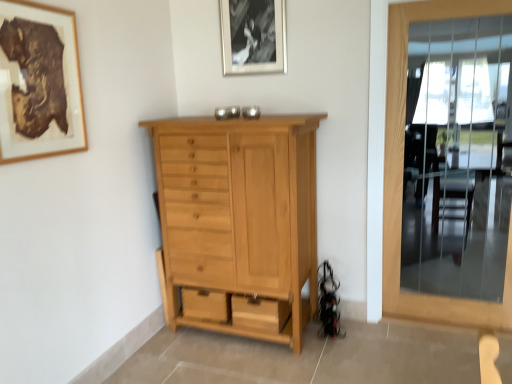
What do you see at coordinates (253, 36) in the screenshot? The width and height of the screenshot is (512, 384). I see `black matte picture frame at upper center, which is the second picture frame in bottom-to-top order` at bounding box center [253, 36].

Locate an element on the screen. The image size is (512, 384). clear glass door at right is located at coordinates (402, 176).

Between clear glass door at right and black matte picture frame at upper center, which is the second picture frame in bottom-to-top order, which one has smaller size?

Smaller between the two is black matte picture frame at upper center, which is the second picture frame in bottom-to-top order.

Who is more distant, clear glass door at right or black matte picture frame at upper center, which is counted as the first picture frame, starting from the top?

black matte picture frame at upper center, which is counted as the first picture frame, starting from the top, is further from the camera.

Which is correct: clear glass door at right is inside black matte picture frame at upper center, which is the second picture frame in bottom-to-top order, or outside of it?

clear glass door at right is outside black matte picture frame at upper center, which is the second picture frame in bottom-to-top order.

Is black matte picture frame at upper center, which is counted as the first picture frame, starting from the top, in front of or behind clear glass door at right in the image?

black matte picture frame at upper center, which is counted as the first picture frame, starting from the top, is behind clear glass door at right.

Can you tell me how much black matte picture frame at upper center, which is counted as the 2th picture frame, starting from the left, and clear glass door at right differ in facing direction?

The facing directions of black matte picture frame at upper center, which is counted as the 2th picture frame, starting from the left, and clear glass door at right are 0.19 degrees apart.

Is black matte picture frame at upper center, positioned as the 2th picture frame in front-to-back order, not near clear glass door at right?

No, black matte picture frame at upper center, positioned as the 2th picture frame in front-to-back order, is in close proximity to clear glass door at right.

Is black matte picture frame at upper center, which is the second picture frame in bottom-to-top order, spatially inside clear glass door at right, or outside of it?

black matte picture frame at upper center, which is the second picture frame in bottom-to-top order, is located beyond the bounds of clear glass door at right.

Do you think wooden picture frame at upper left, placed as the 2th picture frame when sorted from top to bottom, is within clear glass door at right, or outside of it?

wooden picture frame at upper left, placed as the 2th picture frame when sorted from top to bottom, is outside clear glass door at right.

Can you confirm if wooden picture frame at upper left, the 1th picture frame from the bottom, is bigger than clear glass door at right?

No, wooden picture frame at upper left, the 1th picture frame from the bottom, is not bigger than clear glass door at right.

Can you confirm if wooden picture frame at upper left, the 1th picture frame from the bottom, is shorter than clear glass door at right?

Correct, wooden picture frame at upper left, the 1th picture frame from the bottom, is not as tall as clear glass door at right.

From the picture: Is wooden picture frame at upper left, which ranks as the second picture frame in back-to-front order, oriented away from clear glass door at right?

wooden picture frame at upper left, which ranks as the second picture frame in back-to-front order, does not have its back to clear glass door at right.

Considering the sizes of black matte picture frame at upper center, positioned as the 2th picture frame in front-to-back order, and wooden picture frame at upper left, which ranks as the first picture frame in left-to-right order, in the image, is black matte picture frame at upper center, positioned as the 2th picture frame in front-to-back order, wider or thinner than wooden picture frame at upper left, which ranks as the first picture frame in left-to-right order,?

Considering their sizes, black matte picture frame at upper center, positioned as the 2th picture frame in front-to-back order, looks broader than wooden picture frame at upper left, which ranks as the first picture frame in left-to-right order.

From a real-world perspective, which is physically above, black matte picture frame at upper center, positioned as the 2th picture frame in front-to-back order, or wooden picture frame at upper left, the 1th picture frame from the bottom?

From a 3D spatial view, black matte picture frame at upper center, positioned as the 2th picture frame in front-to-back order, is above.

Is black matte picture frame at upper center, which is counted as the 2th picture frame, starting from the left, far from wooden picture frame at upper left, arranged as the second picture frame when viewed from the right?

Yes, black matte picture frame at upper center, which is counted as the 2th picture frame, starting from the left, and wooden picture frame at upper left, arranged as the second picture frame when viewed from the right, are quite far apart.

Locate an element on the screen. picture frame behind the wooden picture frame at upper left, arranged as the second picture frame when viewed from the right is located at coordinates click(253, 36).

Identify the location of the chest of drawers lying below the black matte picture frame at upper center, positioned as the 1th picture frame in right-to-left order (from the image's perspective). This screenshot has height=384, width=512. (239, 222).

Are black matte picture frame at upper center, positioned as the 1th picture frame in right-to-left order, and natural wood cabinet at center far apart?

Actually, black matte picture frame at upper center, positioned as the 1th picture frame in right-to-left order, and natural wood cabinet at center are a little close together.

Could you tell me if black matte picture frame at upper center, positioned as the 2th picture frame in front-to-back order, is turned towards natural wood cabinet at center?

No, black matte picture frame at upper center, positioned as the 2th picture frame in front-to-back order, is not turned towards natural wood cabinet at center.

Is natural wood cabinet at center oriented towards wooden picture frame at upper left, the 1th picture frame from the bottom?

Yes, natural wood cabinet at center is aimed at wooden picture frame at upper left, the 1th picture frame from the bottom.

Image resolution: width=512 pixels, height=384 pixels. Identify the location of the 1st picture frame above the natural wood cabinet at center (from the image's perspective). (39, 83).

Which object is positioned more to the left, natural wood cabinet at center or wooden picture frame at upper left, arranged as the second picture frame when viewed from the right?

wooden picture frame at upper left, arranged as the second picture frame when viewed from the right, is more to the left.

In the image, is natural wood cabinet at center positioned in front of or behind wooden picture frame at upper left, which ranks as the first picture frame in left-to-right order?

Clearly, natural wood cabinet at center is behind wooden picture frame at upper left, which ranks as the first picture frame in left-to-right order.

From a real-world perspective, which is physically below, clear glass door at right or wooden picture frame at upper left, arranged as the second picture frame when viewed from the right?

clear glass door at right is physically lower.

From the image's perspective, which one is positioned lower, clear glass door at right or wooden picture frame at upper left, which ranks as the first picture frame in left-to-right order?

clear glass door at right, from the image's perspective.

The height and width of the screenshot is (384, 512). In order to click on the 2nd picture frame above when counting from the clear glass door at right (from the image's perspective) in this screenshot , I will do `click(253, 36)`.

From the clear glass door at right, count the 1st picture frame to the left and point to it. Please provide its 2D coordinates.

[(253, 36)]

From the image, which object appears to be farther from clear glass door at right, wooden picture frame at upper left, the 1th picture frame from the bottom, or black matte picture frame at upper center, which is counted as the first picture frame, starting from the top?

The object further to clear glass door at right is wooden picture frame at upper left, the 1th picture frame from the bottom.

Looking at the image, which one is located closer to black matte picture frame at upper center, which is the second picture frame in bottom-to-top order, natural wood cabinet at center or clear glass door at right?

natural wood cabinet at center lies closer to black matte picture frame at upper center, which is the second picture frame in bottom-to-top order, than the other object.

Consider the image. Estimate the real-world distances between objects in this image. Which object is closer to clear glass door at right, black matte picture frame at upper center, positioned as the 2th picture frame in front-to-back order, or natural wood cabinet at center?

black matte picture frame at upper center, positioned as the 2th picture frame in front-to-back order.

Estimate the real-world distances between objects in this image. Which object is closer to black matte picture frame at upper center, which is counted as the 2th picture frame, starting from the left, natural wood cabinet at center or wooden picture frame at upper left, which ranks as the second picture frame in back-to-front order?

natural wood cabinet at center is closer to black matte picture frame at upper center, which is counted as the 2th picture frame, starting from the left.

From the picture: Looking at the image, which one is located further to clear glass door at right, wooden picture frame at upper left, the 1th picture frame from the bottom, or natural wood cabinet at center?

Among the two, wooden picture frame at upper left, the 1th picture frame from the bottom, is located further to clear glass door at right.

Which object lies further to the anchor point natural wood cabinet at center, wooden picture frame at upper left, which ranks as the second picture frame in back-to-front order, or clear glass door at right?

clear glass door at right lies further to natural wood cabinet at center than the other object.

Considering their positions, is wooden picture frame at upper left, which ranks as the second picture frame in back-to-front order, positioned further to black matte picture frame at upper center, which is counted as the 2th picture frame, starting from the left, than natural wood cabinet at center?

wooden picture frame at upper left, which ranks as the second picture frame in back-to-front order.

Estimate the real-world distances between objects in this image. Which object is further from clear glass door at right, natural wood cabinet at center or wooden picture frame at upper left, which ranks as the first picture frame in left-to-right order?

Based on the image, wooden picture frame at upper left, which ranks as the first picture frame in left-to-right order, appears to be further to clear glass door at right.

The width and height of the screenshot is (512, 384). I want to click on picture frame between wooden picture frame at upper left, the 1th picture frame from the bottom, and clear glass door at right, in the horizontal direction, so click(253, 36).

Find the location of a particular element. picture frame between natural wood cabinet at center and clear glass door at right is located at coordinates (253, 36).

Where is `picture frame between black matte picture frame at upper center, positioned as the 2th picture frame in front-to-back order, and natural wood cabinet at center, in the vertical direction`? picture frame between black matte picture frame at upper center, positioned as the 2th picture frame in front-to-back order, and natural wood cabinet at center, in the vertical direction is located at coordinates (39, 83).

Where is `chest of drawers between wooden picture frame at upper left, the 1th picture frame from the bottom, and clear glass door at right, in the horizontal direction`? Image resolution: width=512 pixels, height=384 pixels. chest of drawers between wooden picture frame at upper left, the 1th picture frame from the bottom, and clear glass door at right, in the horizontal direction is located at coordinates (239, 222).